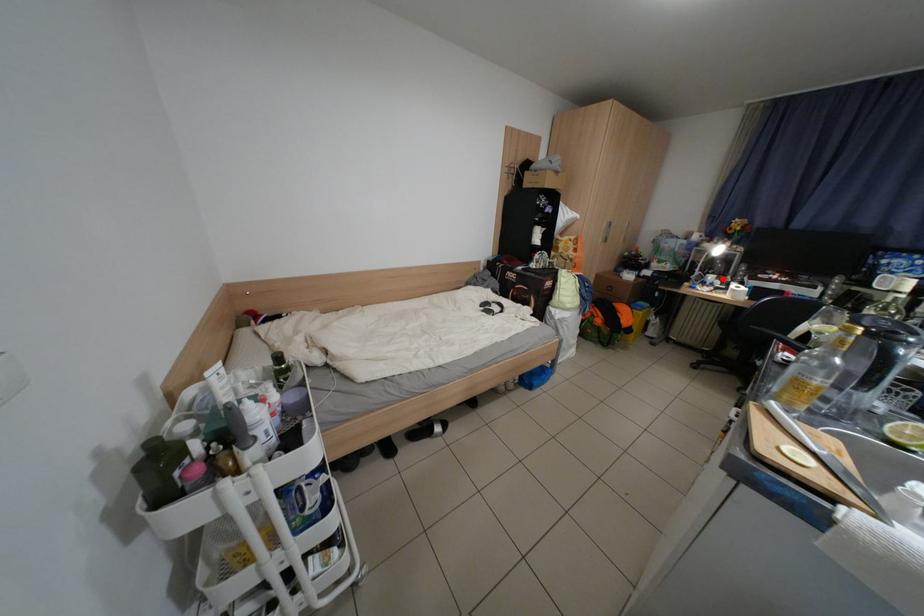
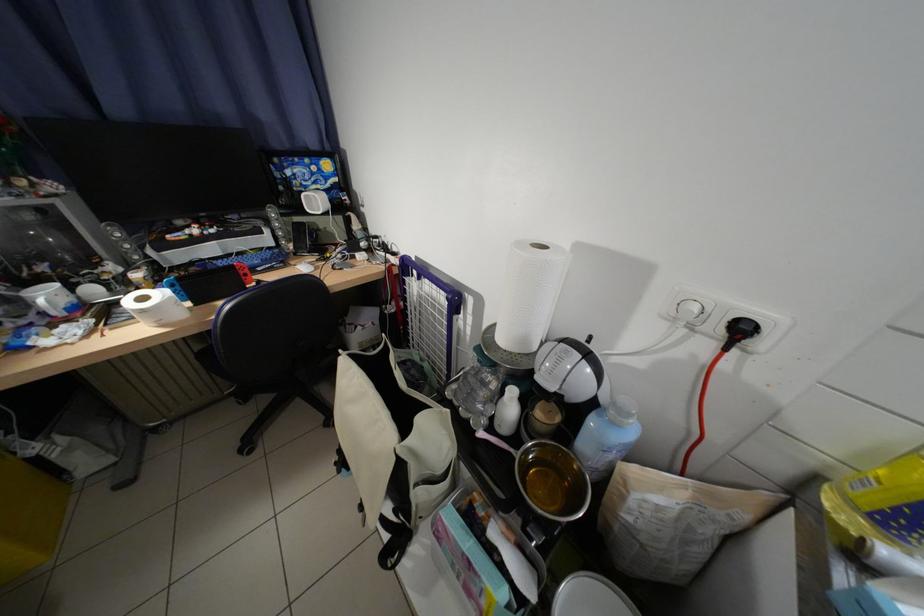
Locate, in the second image, the point that corresponds to the highlighted location in the first image.

(59, 297)